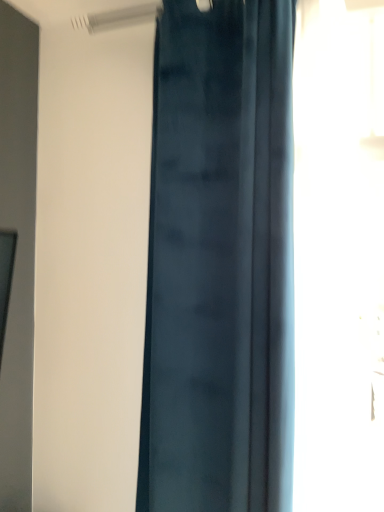
In order to click on transparent glass window at right in this screenshot , I will do `click(339, 258)`.

Image resolution: width=384 pixels, height=512 pixels. What do you see at coordinates (339, 258) in the screenshot? I see `transparent glass window at right` at bounding box center [339, 258].

What is the approximate height of satin blue curtain at center?

satin blue curtain at center is 1.81 meters in height.

This screenshot has width=384, height=512. I want to click on satin blue curtain at center, so pos(217,258).

This screenshot has width=384, height=512. What do you see at coordinates (217, 258) in the screenshot?
I see `satin blue curtain at center` at bounding box center [217, 258].

Identify the location of transparent glass window at right. (339, 258).

From the picture: Between satin blue curtain at center and transparent glass window at right, which one appears on the right side from the viewer's perspective?

From the viewer's perspective, transparent glass window at right appears more on the right side.

Which object is further away from the camera, satin blue curtain at center or transparent glass window at right?

satin blue curtain at center is further away from the camera.

Which is closer, (288, 86) or (342, 495)?

Point (288, 86).

From the image's perspective, does satin blue curtain at center appear lower than transparent glass window at right?

Correct, satin blue curtain at center appears lower than transparent glass window at right in the image.

From a real-world perspective, is satin blue curtain at center positioned over transparent glass window at right based on gravity?

Actually, satin blue curtain at center is physically below transparent glass window at right in the real world.

Consider the image. Considering the sizes of objects satin blue curtain at center and transparent glass window at right in the image provided, who is thinner, satin blue curtain at center or transparent glass window at right?

With smaller width is satin blue curtain at center.

Which of these two, satin blue curtain at center or transparent glass window at right, stands taller?

satin blue curtain at center.

From the picture: Can you confirm if satin blue curtain at center is bigger than transparent glass window at right?

Correct, satin blue curtain at center is larger in size than transparent glass window at right.

Is satin blue curtain at center inside or outside of transparent glass window at right?

satin blue curtain at center is not inside transparent glass window at right, it's outside.

Is satin blue curtain at center touching transparent glass window at right?

No.

Looking at this image, is satin blue curtain at center facing away from transparent glass window at right?

No, satin blue curtain at center is not facing away from transparent glass window at right.

Measure the distance from satin blue curtain at center to transparent glass window at right.

→ satin blue curtain at center is 9.01 inches away from transparent glass window at right.

You are a GUI agent. You are given a task and a screenshot of the screen. Output one action in this format:
    pyautogui.click(x=<x>, y=<y>)
    Task: Click on the window above the satin blue curtain at center (from the image's perspective)
    The width and height of the screenshot is (384, 512).
    Given the screenshot: What is the action you would take?
    pyautogui.click(x=339, y=258)

From the picture: Which object is positioned more to the right, transparent glass window at right or satin blue curtain at center?

transparent glass window at right is more to the right.

Consider the image. Is transparent glass window at right in front of or behind satin blue curtain at center in the image?

Visually, transparent glass window at right is located in front of satin blue curtain at center.

Does point (364, 421) come behind point (275, 248)?

Yes, point (364, 421) is behind point (275, 248).

From the image's perspective, between transparent glass window at right and satin blue curtain at center, which one is located above?

transparent glass window at right appears higher in the image.

From a real-world perspective, is transparent glass window at right located beneath satin blue curtain at center?

Incorrect, from a real-world perspective, transparent glass window at right is higher than satin blue curtain at center.

Which of these two, transparent glass window at right or satin blue curtain at center, is wider?

Wider between the two is transparent glass window at right.

Considering the sizes of transparent glass window at right and satin blue curtain at center in the image, is transparent glass window at right taller or shorter than satin blue curtain at center?

Considering their sizes, transparent glass window at right has less height than satin blue curtain at center.

Is transparent glass window at right bigger than satin blue curtain at center?

Actually, transparent glass window at right might be smaller than satin blue curtain at center.

Is transparent glass window at right not within satin blue curtain at center?

Yes, transparent glass window at right is not within satin blue curtain at center.

Would you say transparent glass window at right is a long distance from satin blue curtain at center?

No.

Is transparent glass window at right oriented towards satin blue curtain at center?

No, transparent glass window at right is not aimed at satin blue curtain at center.

Can you tell me how much transparent glass window at right and satin blue curtain at center differ in facing direction?

0.00027 degrees separate the facing orientations of transparent glass window at right and satin blue curtain at center.

At what (x,y) coordinates should I click in order to perform the action: click on curtain located on the left of transparent glass window at right. Please return your answer as a coordinate pair (x, y). Looking at the image, I should click on (217, 258).

In order to click on curtain that appears behind the transparent glass window at right in this screenshot , I will do `click(217, 258)`.

This screenshot has width=384, height=512. There is a satin blue curtain at center. What are the coordinates of `window above it (from a real-world perspective)` in the screenshot? It's located at (339, 258).